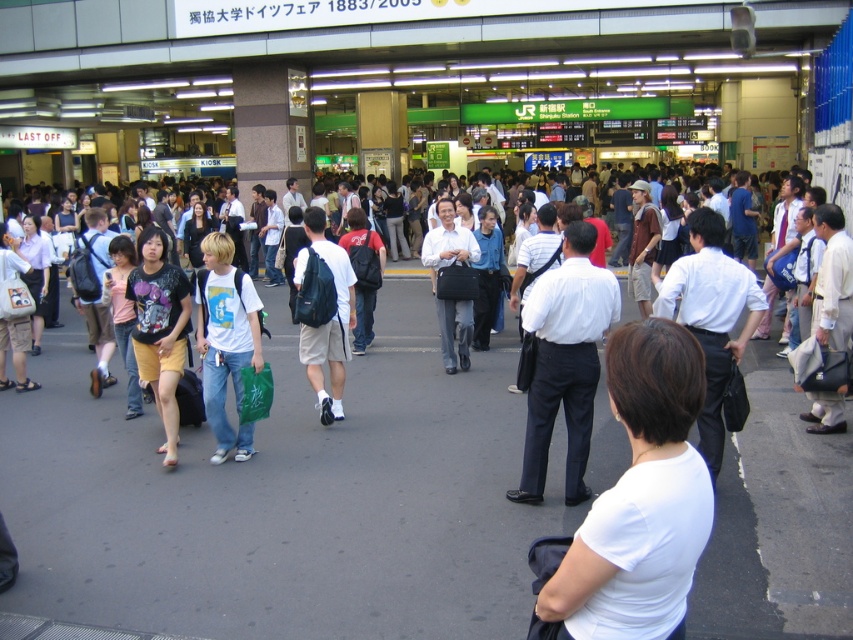
Question: Does white smooth shirt at center come behind matte black backpack at center?

Choices:
 (A) yes
 (B) no

Answer: (B)

Question: Which object is the farthest from the matte black t-shirt at center?

Choices:
 (A) white matte shirt at center
 (B) white matte t-shirt at center
 (C) matte black backpack at center
 (D) white shirt at center

Answer: (A)

Question: Estimate the real-world distances between objects in this image. Which object is closer to the matte black t-shirt at center?

Choices:
 (A) white smooth shirt at center
 (B) white matte t-shirt at center
 (C) white matte shirt at center
 (D) white shirt at center

Answer: (B)

Question: Does matte black backpack at center lie behind white shirt at center?

Choices:
 (A) no
 (B) yes

Answer: (A)

Question: Which point is farther to the camera?

Choices:
 (A) (167, 436)
 (B) (676, 476)
 (C) (457, 355)
 (D) (202, 344)

Answer: (C)

Question: Can you confirm if white smooth shirt at center is bigger than white matte t-shirt at center?

Choices:
 (A) no
 (B) yes

Answer: (B)